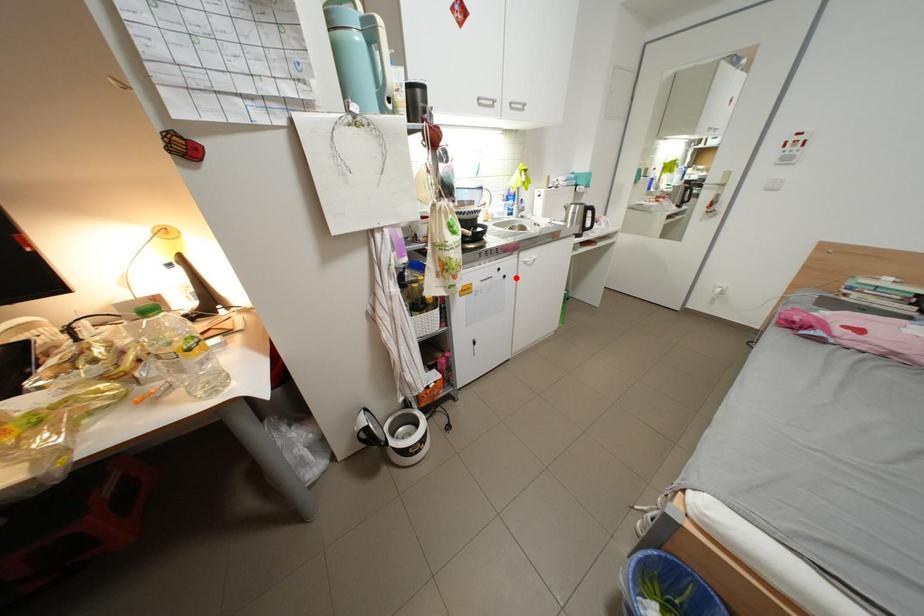
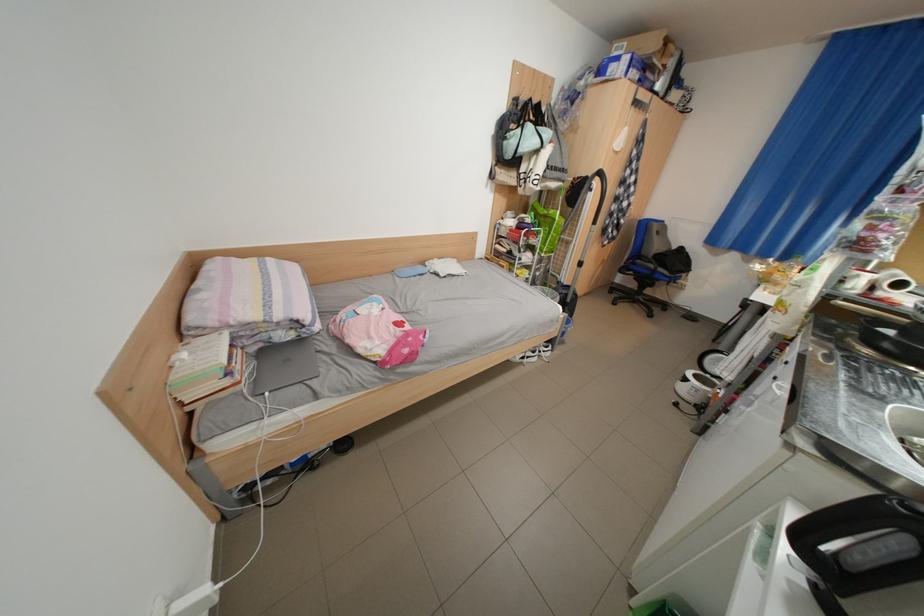
Question: I am providing you with two images of the same scene from different viewpoints. A red point is shown in image1. For the corresponding object point in image2, is it positioned nearer or farther from the camera?

Choices:
 (A) Nearer
 (B) Farther

Answer: (B)